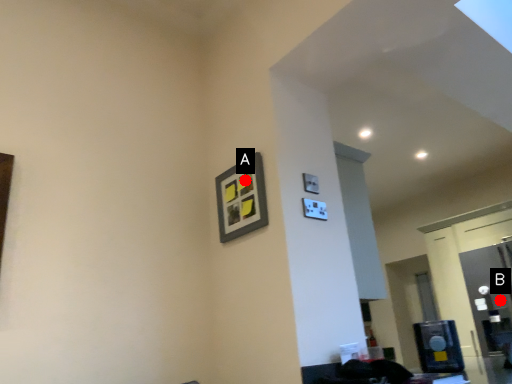
Question: Two points are circled on the image, labeled by A and B beside each circle. Which of the following is the farthest from the observer?

Choices:
 (A) A is further
 (B) B is further

Answer: (B)